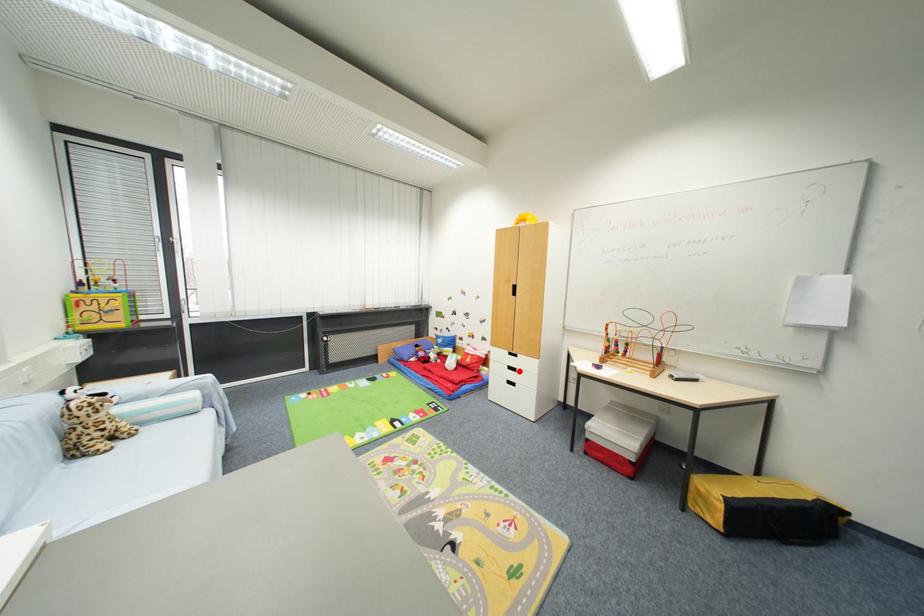
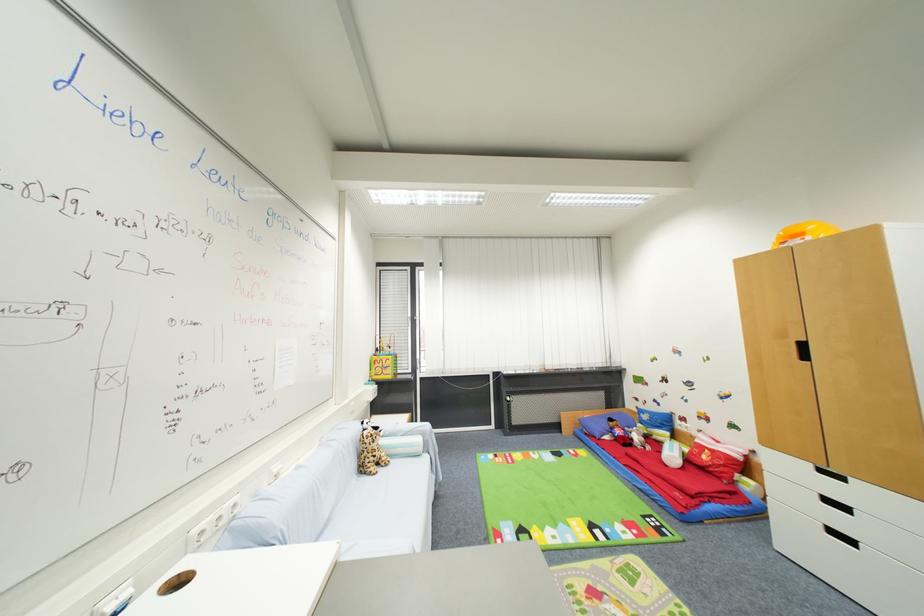
The point at the highlighted location is marked in the first image. Where is the corresponding point in the second image?

(849, 509)